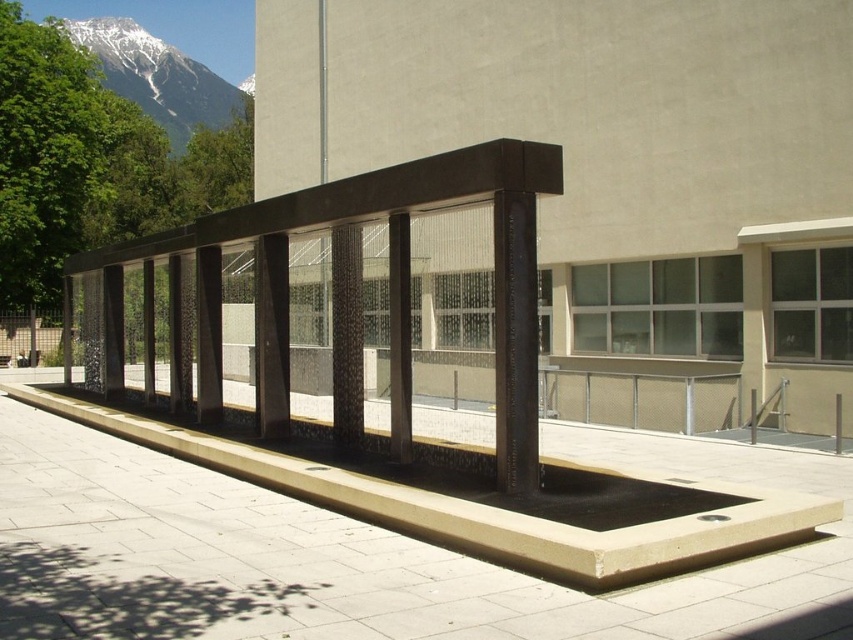
You are a visitor standing at the entrance of the courtyard. You notice the black textured rail at center and the snowy granite mountain at upper left. Which object is closer to you from your current position?

The black textured rail at center is closer to you than the snowy granite mountain at upper left because it is positioned under it, indicating a front to back relationship.

You are an architect designing a new pathway that needs to pass between the black textured rail at center and the snowy granite mountain at upper left. Given their sizes, which object should the pathway be designed to go around first?

The pathway should be designed to go around the black textured rail at center first since it has a smaller size compared to the snowy granite mountain at upper left, making it easier to navigate around the smaller object first.